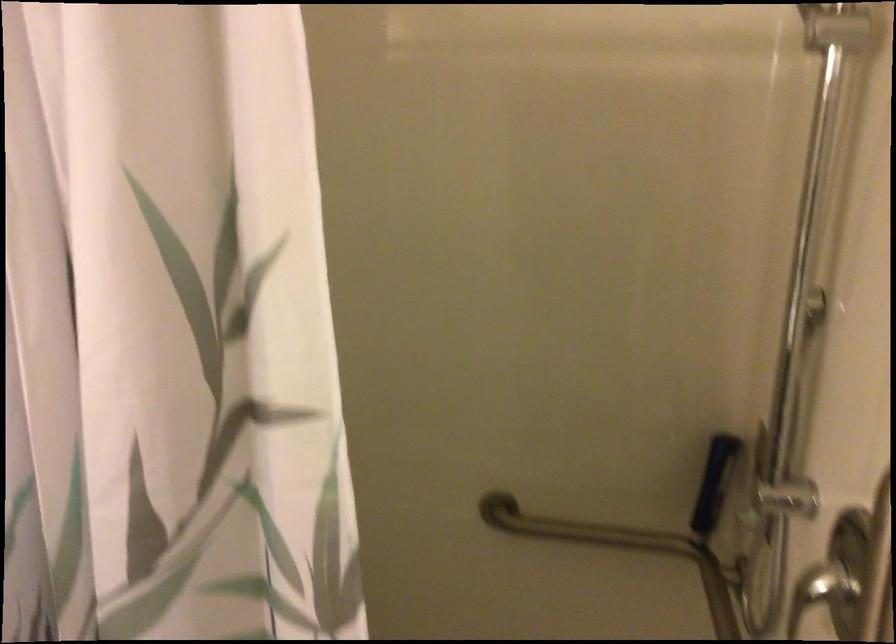
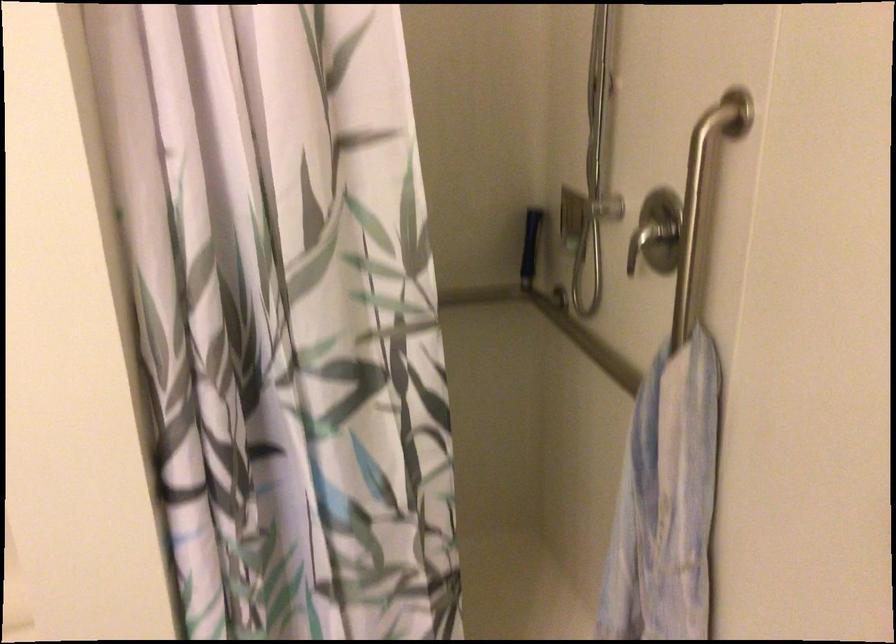
Question: How did the camera likely rotate?

Choices:
 (A) Left
 (B) Right
 (C) Up
 (D) Down

Answer: (B)